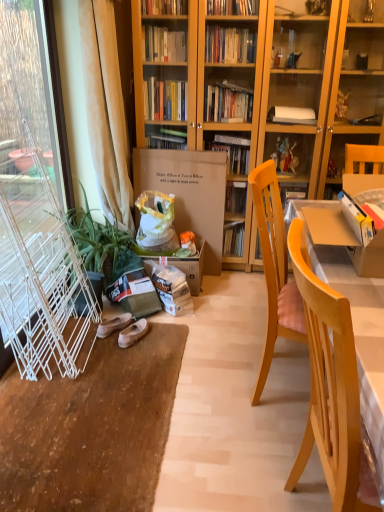
Question: Does light wood chair at right contain brown cardboard box at center?

Choices:
 (A) yes
 (B) no

Answer: (B)

Question: Can we say light wood chair at right lies outside brown cardboard box at center?

Choices:
 (A) yes
 (B) no

Answer: (A)

Question: From a real-world perspective, is light wood chair at right on top of brown cardboard box at center?

Choices:
 (A) no
 (B) yes

Answer: (A)

Question: Is light wood chair at right positioned with its back to brown cardboard box at center?

Choices:
 (A) no
 (B) yes

Answer: (A)

Question: Is light wood chair at right in front of brown cardboard box at center?

Choices:
 (A) no
 (B) yes

Answer: (B)

Question: From the image's perspective, is light wood chair at right on top of brown cardboard box at center?

Choices:
 (A) no
 (B) yes

Answer: (A)

Question: Is white fabric slipper at lower left, the 2th footwear viewed from the right, completely or partially outside of white wire screen door at left?

Choices:
 (A) yes
 (B) no

Answer: (A)

Question: Is white fabric slipper at lower left, the 2th footwear viewed from the right, next to white wire screen door at left and touching it?

Choices:
 (A) no
 (B) yes

Answer: (A)

Question: Can you confirm if white fabric slipper at lower left, the 2th footwear viewed from the right, is smaller than white wire screen door at left?

Choices:
 (A) yes
 (B) no

Answer: (A)

Question: From the image's perspective, is white fabric slipper at lower left, the 2th footwear viewed from the right, located beneath white wire screen door at left?

Choices:
 (A) no
 (B) yes

Answer: (B)

Question: From a real-world perspective, is white fabric slipper at lower left, the 2th footwear viewed from the right, below white wire screen door at left?

Choices:
 (A) yes
 (B) no

Answer: (A)

Question: Is white fabric slipper at lower left, acting as the 1th footwear starting from the left, positioned before white wire screen door at left?

Choices:
 (A) yes
 (B) no

Answer: (B)

Question: Could you tell me if white wire screen door at left is turned towards light wood chair at right?

Choices:
 (A) no
 (B) yes

Answer: (B)